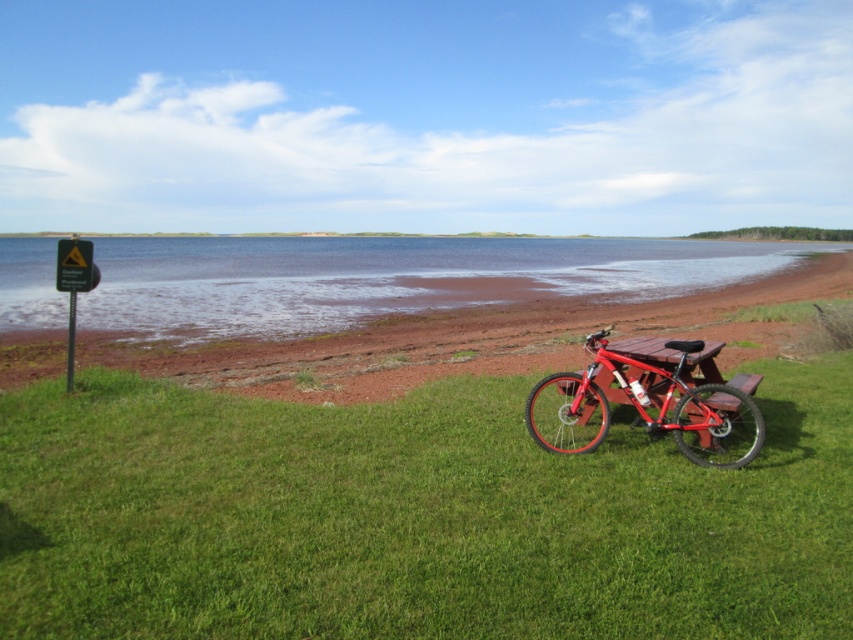
You are standing at the picnic table and want to place a small basket on the shiny red mountain bike at center. Can you put it directly on top of the bike without it falling into the clear blue water at center?

The clear blue water at center is above the shiny red mountain bike at center, so placing the basket directly on top of the bike would risk it falling into the water since the water is positioned higher than the bike.

You are standing at the edge of the water and want to reach the shiny red mountain bike at center without getting wet. The clear blue water at center is between you and the bike. What is the minimum distance you need to walk around the water to reach the bike?

The clear blue water at center is 37.83 meters from the shiny red mountain bike at center. To avoid getting wet, you would need to walk around the water along the shore. The shortest path would require walking approximately 37.83 meters multiplied by pi, which is roughly 118.3 meters, assuming the water forms a circular obstacle.